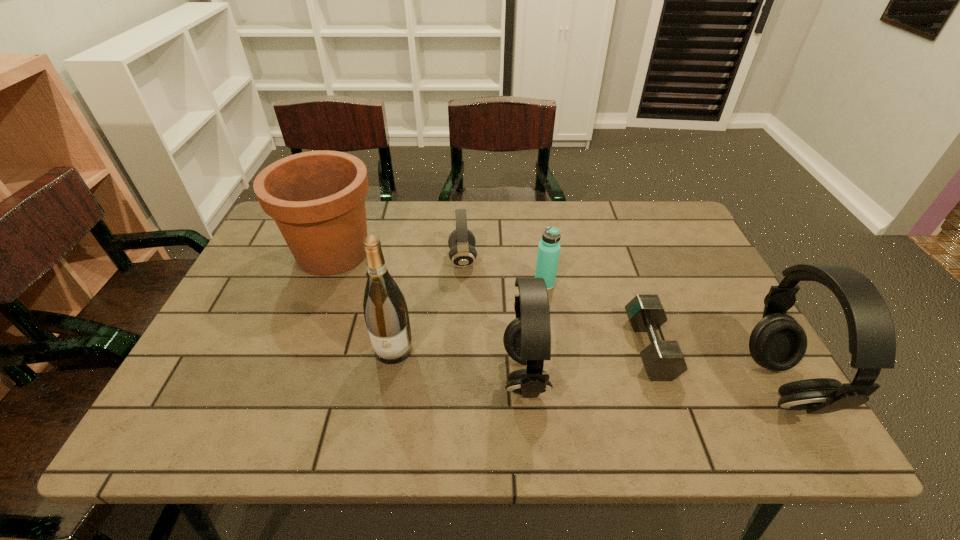
Find the location of a particular element. This screenshot has height=540, width=960. the left earphone is located at coordinates (527, 339).

Where is `the right earphone`? The image size is (960, 540). the right earphone is located at coordinates (777, 342).

Where is `the taller earphone`? the taller earphone is located at coordinates (777, 342).

You are a GUI agent. You are given a task and a screenshot of the screen. Output one action in this format:
    pyautogui.click(x=<x>, y=<y>)
    Task: Click on the thermos bottle
    The width and height of the screenshot is (960, 540).
    Given the screenshot: What is the action you would take?
    pyautogui.click(x=548, y=253)

At what (x,y) coordinates should I click in order to perform the action: click on the leftmost object. Please return your answer as a coordinate pair (x, y). Looking at the image, I should click on (317, 198).

At what (x,y) coordinates should I click in order to perform the action: click on the second shortest object. Please return your answer as a coordinate pair (x, y). This screenshot has height=540, width=960. Looking at the image, I should click on (461, 241).

At what (x,y) coordinates should I click in order to perform the action: click on headset. Please return your answer as a coordinate pair (x, y). The height and width of the screenshot is (540, 960). Looking at the image, I should click on (461, 241).

Find the location of `wine bottle`. wine bottle is located at coordinates (386, 315).

You are a GUI agent. You are given a task and a screenshot of the screen. Output one action in this format:
    pyautogui.click(x=<x>, y=<y>)
    Task: Click on the shortest object
    This screenshot has width=960, height=540.
    Given the screenshot: What is the action you would take?
    pyautogui.click(x=663, y=360)

You are a GUI agent. You are given a task and a screenshot of the screen. Output one action in this format:
    pyautogui.click(x=<x>, y=<y>)
    Task: Click on the sixth object from left to right
    This screenshot has width=960, height=540.
    Given the screenshot: What is the action you would take?
    pyautogui.click(x=663, y=360)